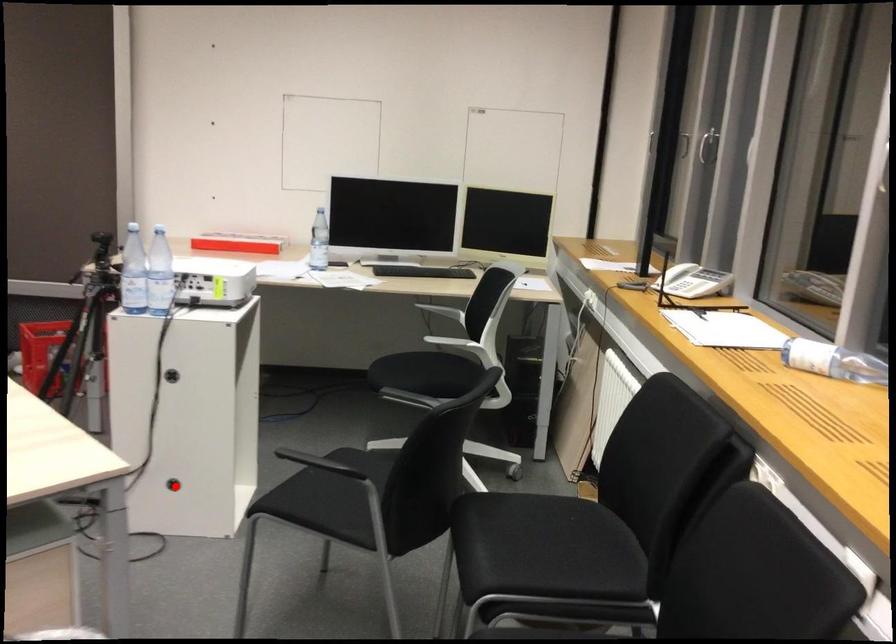
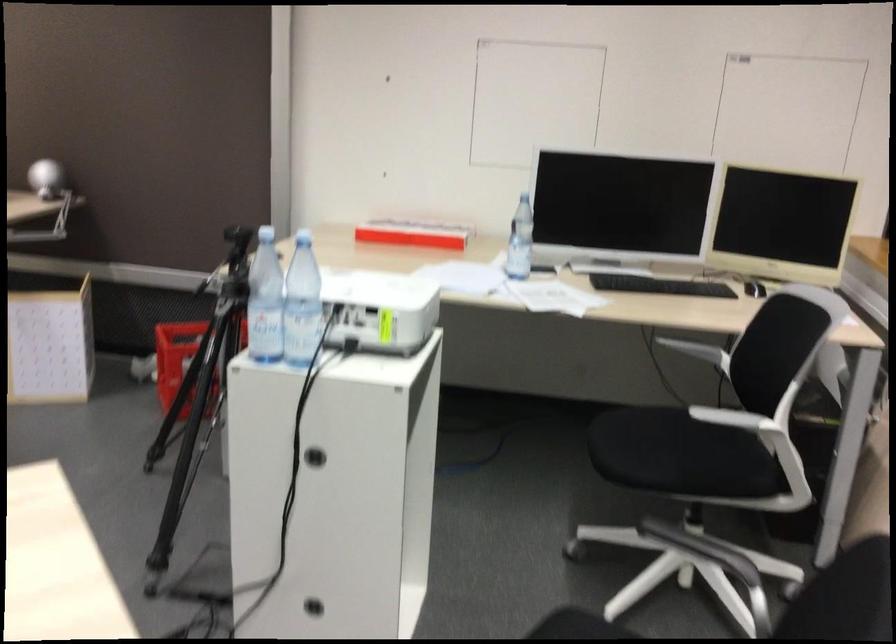
Question: I am providing you with two images of the same scene from different viewpoints. In image1, a red point is highlighted. Considering the same 3D point in image2, which of the following is correct?

Choices:
 (A) It is closer
 (B) It is farther

Answer: (A)